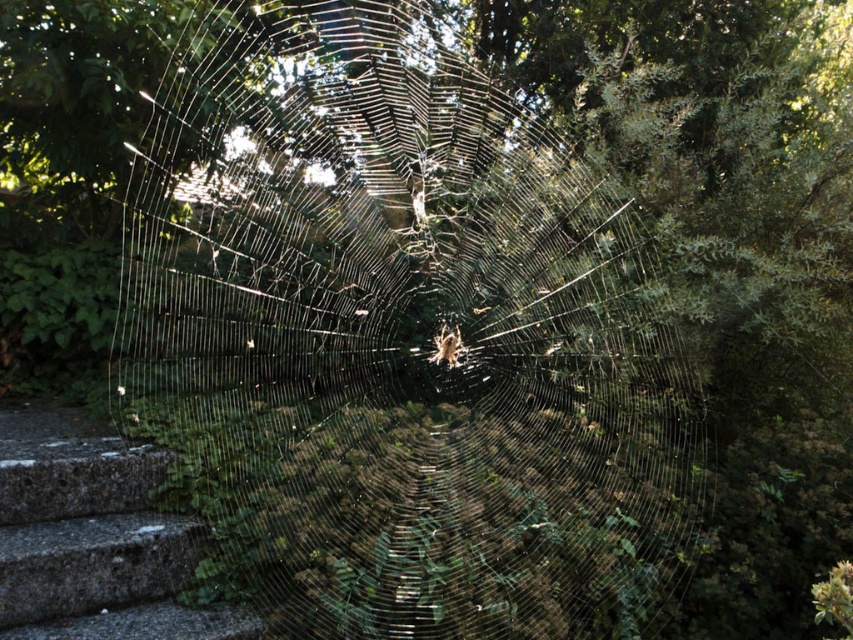
You are a painter standing at the bottom of the gray concrete stairs at lower left, looking up at the transparent silk spider web at center. Which object is higher in your field of view?

The transparent silk spider web at center is taller than the gray concrete stairs at lower left, so it appears higher in your field of view.

You are an entomologist observing the spider web and spider. Which object is located above the other between the transparent silk spider web at center and the brown fuzzy spider at center?

The transparent silk spider web at center is positioned over brown fuzzy spider at center, meaning the web is above the spider.

You are standing at the bottom of the gray concrete stairs at lower left and want to reach the brown fuzzy spider at center. Which direction should you move to get closer to the spider?

The gray concrete stairs at lower left are wider than the brown fuzzy spider at center, so to reach the spider, you should move towards the center of the image where the spider is located, away from the stairs.